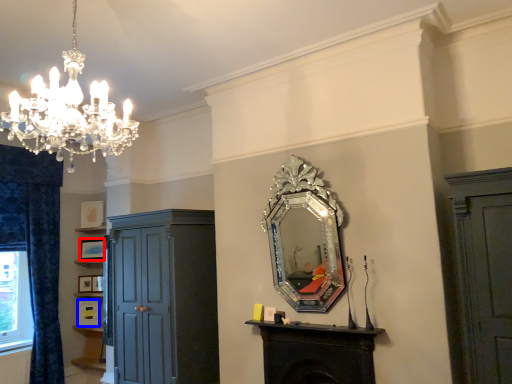
Question: Which object is closer to the camera taking this photo, picture frame (highlighted by a red box) or picture frame (highlighted by a blue box)?

Choices:
 (A) picture frame
 (B) picture frame

Answer: (B)